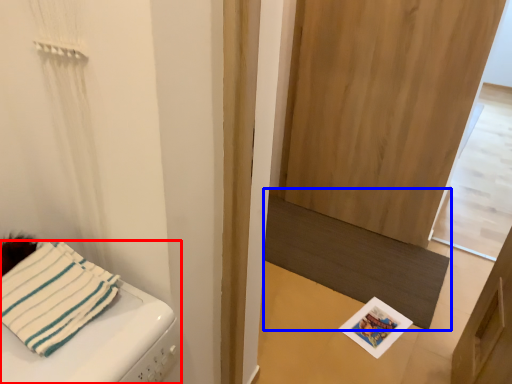
Question: Which object appears closest to the camera in this image, furniture (highlighted by a red box) or mat (highlighted by a blue box)?

Choices:
 (A) furniture
 (B) mat

Answer: (A)